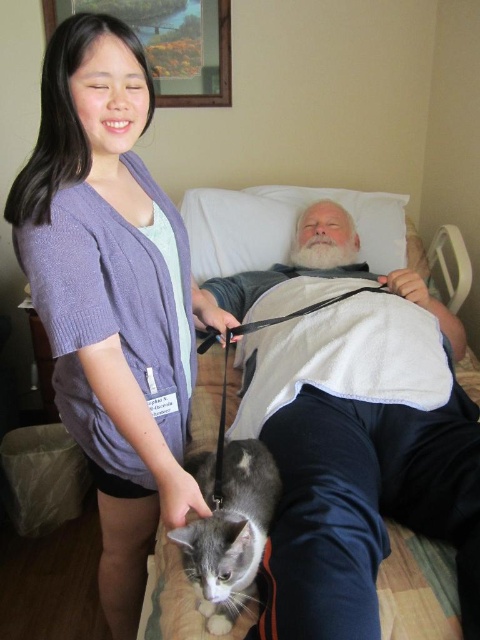
Question: Which point is closer to the camera?

Choices:
 (A) gray fur cat at lower left
 (B) gray fur cat at lower center
 (C) purple knitted cardigan at upper left

Answer: (A)

Question: Does gray fur cat at lower left appear under purple knitted cardigan at upper left?

Choices:
 (A) yes
 (B) no

Answer: (B)

Question: Which point is farther to the camera?

Choices:
 (A) (207, 573)
 (B) (436, 468)

Answer: (B)

Question: Which object is closer to the camera taking this photo?

Choices:
 (A) gray fur cat at lower center
 (B) purple knitted cardigan at upper left

Answer: (A)

Question: Is gray fur cat at lower left positioned in front of purple knitted cardigan at upper left?

Choices:
 (A) yes
 (B) no

Answer: (A)

Question: Is gray fur cat at lower left bigger than gray fur cat at lower center?

Choices:
 (A) no
 (B) yes

Answer: (B)